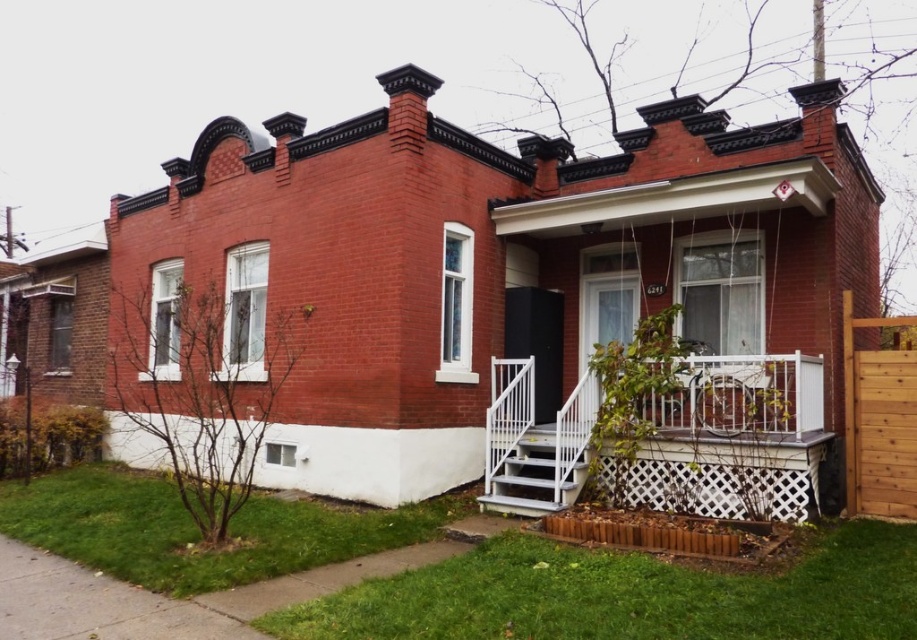
You are planning to place a bench on the white lattice porch at center. The bench requires a space wider than the white painted wood stairs at lower center. Can the bench fit on the porch?

The white lattice porch at center is wider than the white painted wood stairs at lower center. Therefore, the bench can fit on the porch as it has sufficient width.

You are standing in front of the house and want to walk onto the white lattice porch at center. Are the white painted wood stairs at lower center between you and the porch?

The white lattice porch at center is closer to the viewer than the white painted wood stairs at lower center, so the stairs are not between you and the porch. The porch itself is in front of the stairs.